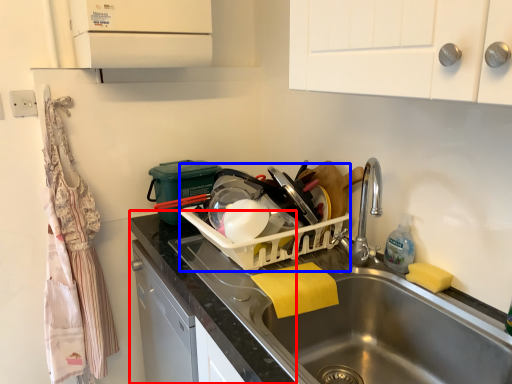
Question: Among these objects, which one is nearest to the camera, counter top (highlighted by a red box) or appliance (highlighted by a blue box)?

Choices:
 (A) counter top
 (B) appliance

Answer: (A)